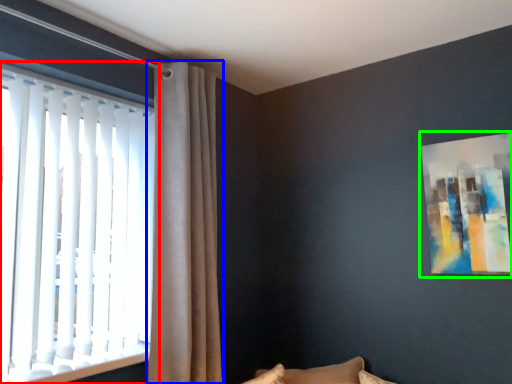
Question: Estimate the real-world distances between objects in this image. Which object is farther from window (highlighted by a red box), curtain (highlighted by a blue box) or picture frame (highlighted by a green box)?

Choices:
 (A) curtain
 (B) picture frame

Answer: (B)